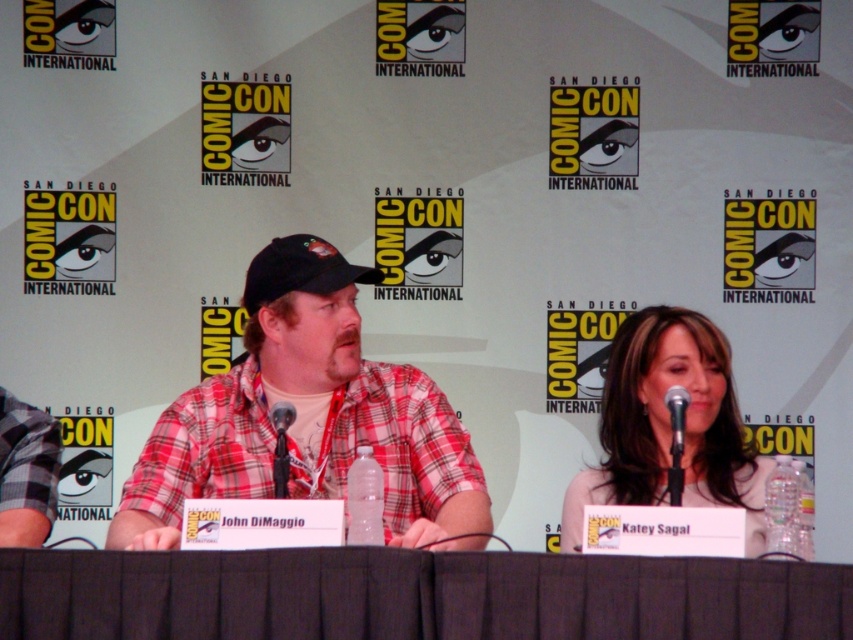
You are attending a panel discussion at ComicCon and see two people on stage. One is wearing a plaid shirt at center and the other a smooth beige blouse at center. Which one is sitting on the left side?

The plaid shirt at center is sitting on the left side of the smooth beige blouse at center.

You are attending Comic Con and want to take a photo of the black fabric table at center. What are the coordinates where you should aim your camera?

The black fabric table at center is located at coordinates point (415, 595).

You are an attendee at Comic Con and you want to take a photo of the panel discussion. You notice the smooth beige blouse at center and the black metallic microphone at center. Which object is positioned closer to you?

The smooth beige blouse at center is closer to the viewer than the black metallic microphone at center.